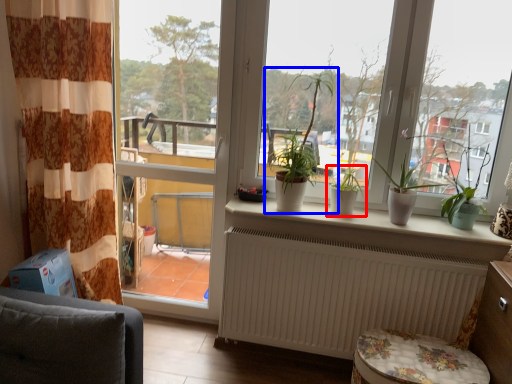
Question: Which object appears farthest to the camera in this image, houseplant (highlighted by a red box) or houseplant (highlighted by a blue box)?

Choices:
 (A) houseplant
 (B) houseplant

Answer: (A)